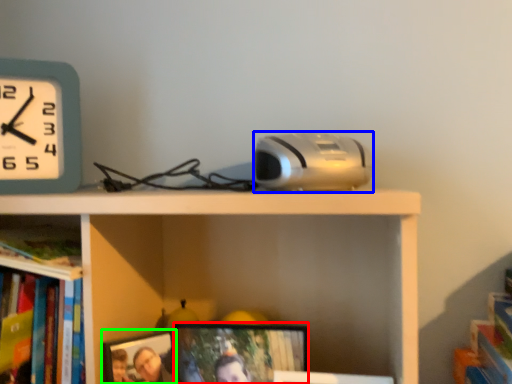
Question: Which is farther away from picture frame (highlighted by a red box)? gadget (highlighted by a blue box) or picture frame (highlighted by a green box)?

Choices:
 (A) gadget
 (B) picture frame

Answer: (A)